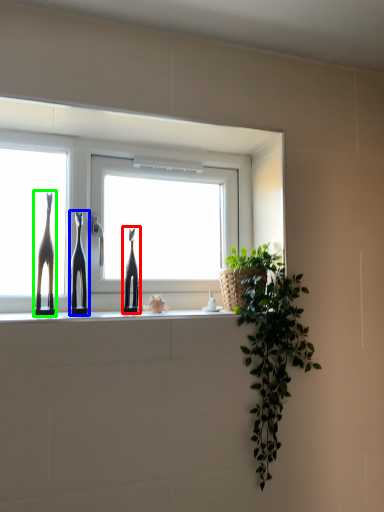
Question: Which is nearer to the sculpture (highlighted by a red box)? sculpture (highlighted by a blue box) or giraffe (highlighted by a green box).

Choices:
 (A) sculpture
 (B) giraffe

Answer: (A)